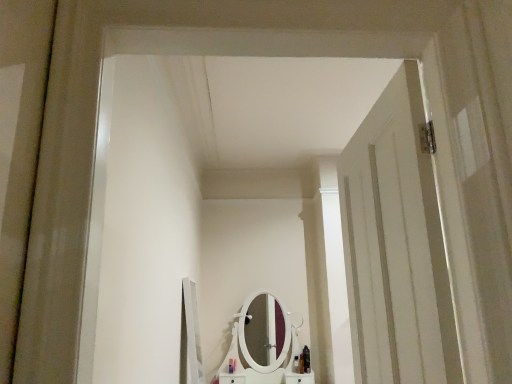
Question: Considering the relative sizes of translucent plastic bottle at center, the 4th toiletry viewed from the right, and shiny black bottle at lower center, the 5th toiletry viewed from the left, in the image provided, is translucent plastic bottle at center, the 4th toiletry viewed from the right, smaller than shiny black bottle at lower center, the 5th toiletry viewed from the left,?

Choices:
 (A) no
 (B) yes

Answer: (B)

Question: Does translucent plastic bottle at center, which appears as the 2th toiletry when viewed from the left, have a greater width compared to shiny black bottle at lower center, which appears as the first toiletry when viewed from the right?

Choices:
 (A) no
 (B) yes

Answer: (A)

Question: Is translucent plastic bottle at center, the 4th toiletry viewed from the right, thinner than shiny black bottle at lower center, which appears as the first toiletry when viewed from the right?

Choices:
 (A) no
 (B) yes

Answer: (B)

Question: From a real-world perspective, is translucent plastic bottle at center, the 4th toiletry viewed from the right, beneath shiny black bottle at lower center, which appears as the first toiletry when viewed from the right?

Choices:
 (A) no
 (B) yes

Answer: (B)

Question: Is translucent plastic bottle at center, the 4th toiletry viewed from the right, positioned behind shiny black bottle at lower center, the 5th toiletry viewed from the left?

Choices:
 (A) no
 (B) yes

Answer: (A)

Question: Is shiny black bottle at lower center, which appears as the first toiletry when viewed from the right, at the back of translucent plastic bottle at center, the 4th toiletry viewed from the right?

Choices:
 (A) no
 (B) yes

Answer: (A)

Question: From a real-world perspective, is white wooden door at right beneath shiny black bottle at center, which appears as the 2th toiletry when viewed from the right?

Choices:
 (A) yes
 (B) no

Answer: (B)

Question: Is shiny black bottle at center, which appears as the 2th toiletry when viewed from the right, a part of white wooden door at right?

Choices:
 (A) no
 (B) yes

Answer: (A)

Question: Is white wooden door at right closer to camera compared to shiny black bottle at center, which appears as the 2th toiletry when viewed from the right?

Choices:
 (A) no
 (B) yes

Answer: (B)

Question: Is white wooden door at right located outside shiny black bottle at center, the 4th toiletry from the left?

Choices:
 (A) no
 (B) yes

Answer: (B)

Question: Is white wooden door at right at the left side of shiny black bottle at center, which appears as the 2th toiletry when viewed from the right?

Choices:
 (A) yes
 (B) no

Answer: (A)

Question: Can you confirm if white wooden door at right is bigger than shiny black bottle at center, the 4th toiletry from the left?

Choices:
 (A) yes
 (B) no

Answer: (A)

Question: Considering the relative sizes of translucent plastic bottle at center, placed as the 1th toiletry when sorted from left to right, and white wooden door at right in the image provided, is translucent plastic bottle at center, placed as the 1th toiletry when sorted from left to right, taller than white wooden door at right?

Choices:
 (A) no
 (B) yes

Answer: (A)